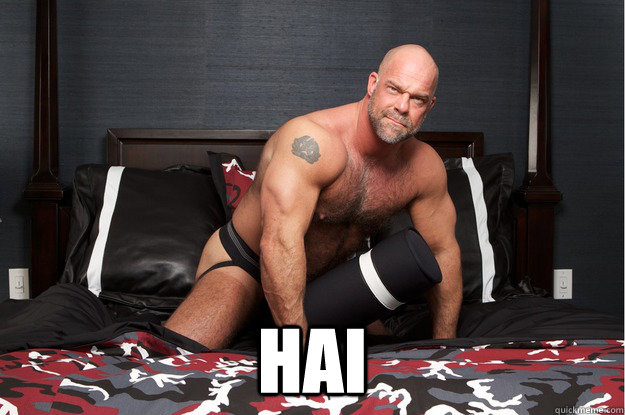
Find the location of a particular element. This screenshot has width=625, height=415. headboard is located at coordinates (182, 157).